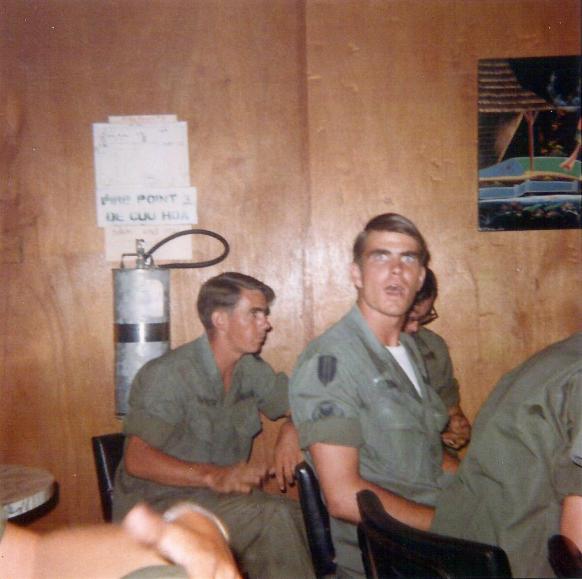
Where is `chair`? The width and height of the screenshot is (582, 579). chair is located at coordinates (416, 541), (322, 526), (109, 461).